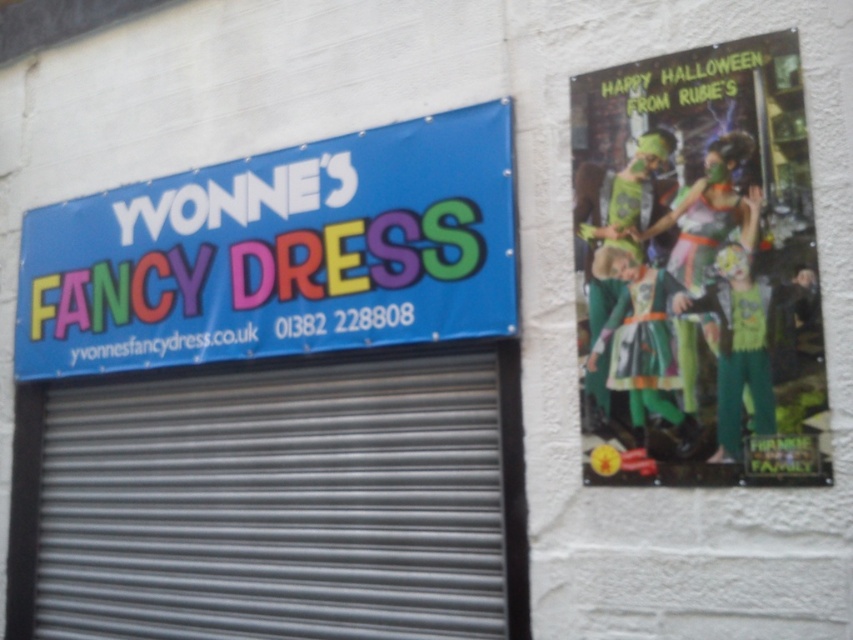
Question: In this image, where is metallic gray garage door at center located relative to blue fabric sign at upper left?

Choices:
 (A) right
 (B) left

Answer: (A)

Question: Can you confirm if metallic gray garage door at center is smaller than blue fabric sign at upper left?

Choices:
 (A) no
 (B) yes

Answer: (A)

Question: Does green fabric costume at upper right have a greater width compared to blue fabric sign at upper left?

Choices:
 (A) no
 (B) yes

Answer: (A)

Question: Which of these objects is positioned closest to the metallic gray garage door at center?

Choices:
 (A) blue fabric sign at upper left
 (B) green fabric costume at upper right

Answer: (A)

Question: Which point appears closest to the camera in this image?

Choices:
 (A) (68, 625)
 (B) (91, 312)

Answer: (A)

Question: Which object is farther from the camera taking this photo?

Choices:
 (A) green fabric costume at upper right
 (B) blue fabric sign at upper left

Answer: (B)